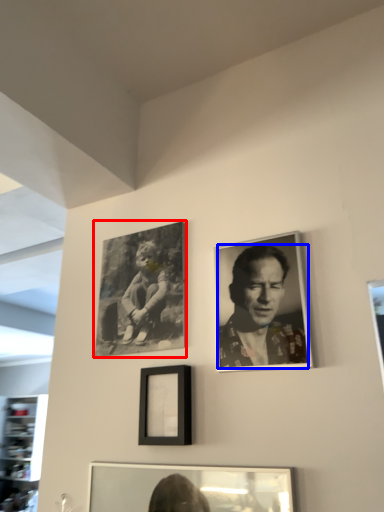
Question: Which of the following is the farthest to the observer, picture frame (highlighted by a red box) or man (highlighted by a blue box)?

Choices:
 (A) picture frame
 (B) man

Answer: (A)